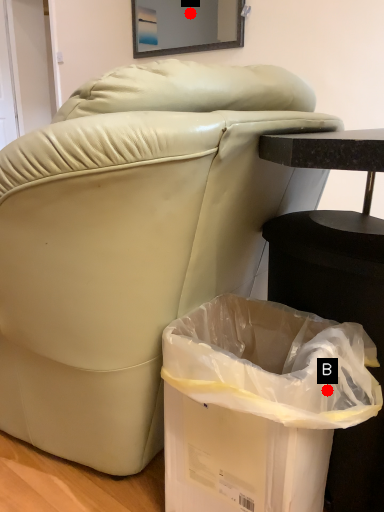
Question: Two points are circled on the image, labeled by A and B beside each circle. Which point is closer to the camera?

Choices:
 (A) A is closer
 (B) B is closer

Answer: (B)